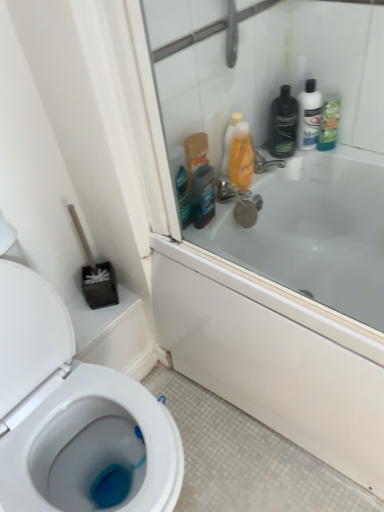
Question: Is point (205, 16) closer or farther from the camera than point (201, 180)?

Choices:
 (A) closer
 (B) farther

Answer: (A)

Question: From the image's perspective, is transparent glass screen door at upper right above or below dark brown plastic mouthwash at upper right?

Choices:
 (A) below
 (B) above

Answer: (B)

Question: Which is nearer to the dark brown plastic mouthwash at upper right?

Choices:
 (A) metallic silver faucet at upper right
 (B) green matte bottle at upper right, which is counted as the second cleaning product, starting from the left
 (C) black matte bottle at upper right, the 1th toiletry when ordered from left to right
 (D) translucent orange bottle at upper right, the 1th cleaning product in the left-to-right sequence
 (E) white glossy lotion at upper right, arranged as the 2th toiletry when viewed from the left

Answer: (D)

Question: Which is farther from the green matte bottle at upper right, which is counted as the second cleaning product, starting from the left?

Choices:
 (A) translucent orange bottle at upper right, the 1th cleaning product in the left-to-right sequence
 (B) metallic silver faucet at upper right
 (C) dark brown plastic mouthwash at upper right
 (D) black matte bottle at upper right, the 2th toiletry from the right
 (E) white glossy lotion at upper right, positioned as the 1th toiletry in right-to-left order

Answer: (C)